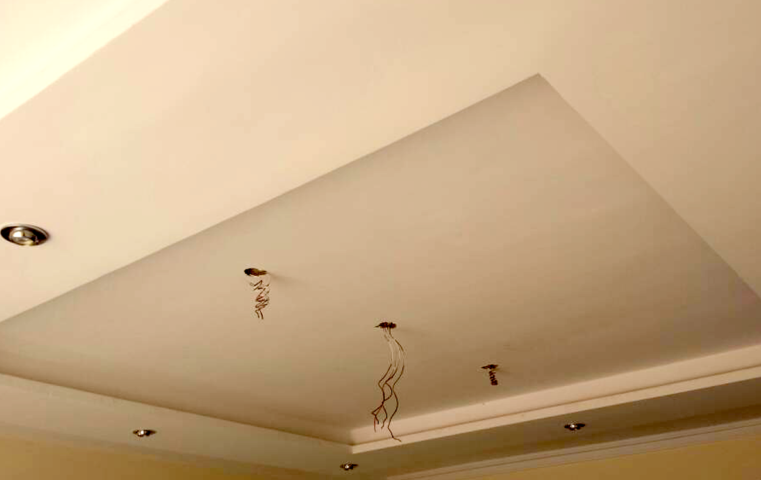
Locate an element on the screen. bronze part of wiring is located at coordinates (384, 402), (260, 306).